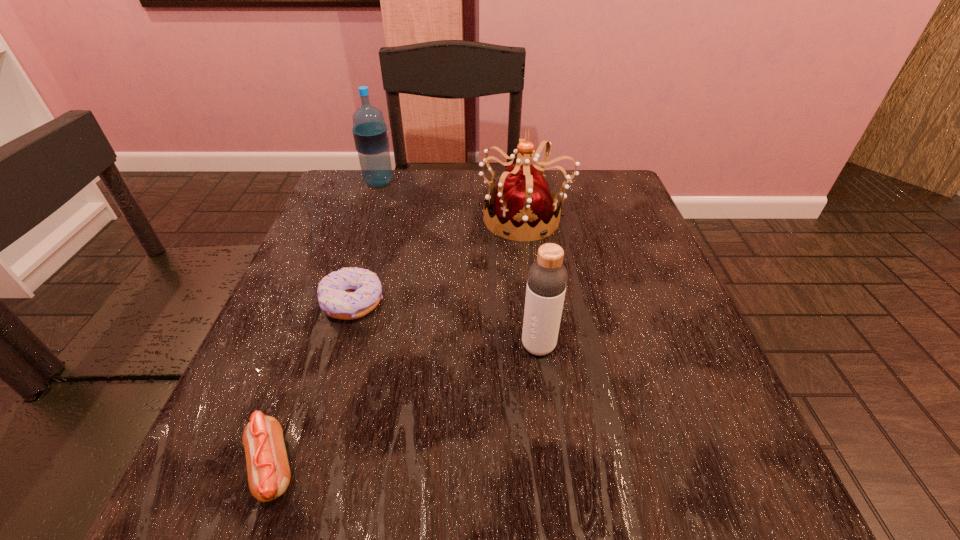
Identify the location of object at the near left corner. (268, 469).

Image resolution: width=960 pixels, height=540 pixels. I want to click on object that is at the far right corner, so click(523, 204).

Locate an element on the screen. Image resolution: width=960 pixels, height=540 pixels. free region at the near edge of the desktop is located at coordinates (548, 482).

Image resolution: width=960 pixels, height=540 pixels. I want to click on free point at the left edge, so click(337, 231).

This screenshot has height=540, width=960. In the image, there is a desktop. What are the coordinates of `free space at the right edge` in the screenshot? It's located at (640, 348).

The width and height of the screenshot is (960, 540). Find the location of `vacant space at the far right corner`. vacant space at the far right corner is located at coordinates (630, 218).

Image resolution: width=960 pixels, height=540 pixels. Find the location of `free spot at the near right corner of the desktop`. free spot at the near right corner of the desktop is located at coordinates (656, 485).

This screenshot has height=540, width=960. Identify the location of free point between the second farthest object and the doughnut. (439, 260).

The image size is (960, 540). I want to click on vacant space that's between the fourth farthest object and the water bottle, so click(459, 264).

You are a GUI agent. You are given a task and a screenshot of the screen. Output one action in this format:
    pyautogui.click(x=<x>, y=<y>)
    Task: Click on the vacant region between the farthest object and the tiara
    
    Given the screenshot: What is the action you would take?
    pyautogui.click(x=452, y=200)